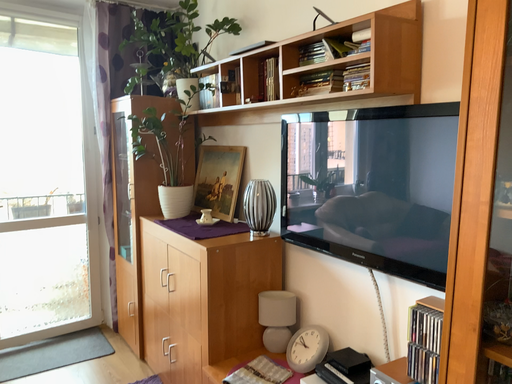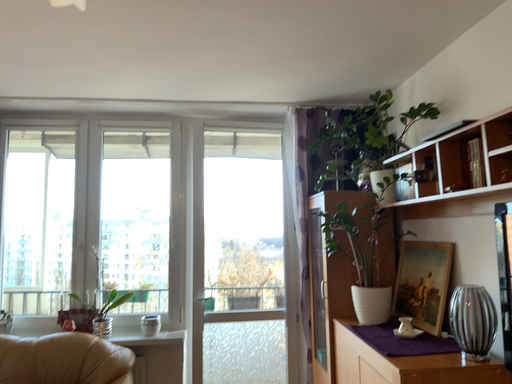
Question: Which way did the camera rotate in the video?

Choices:
 (A) rotated downward
 (B) rotated upward

Answer: (B)